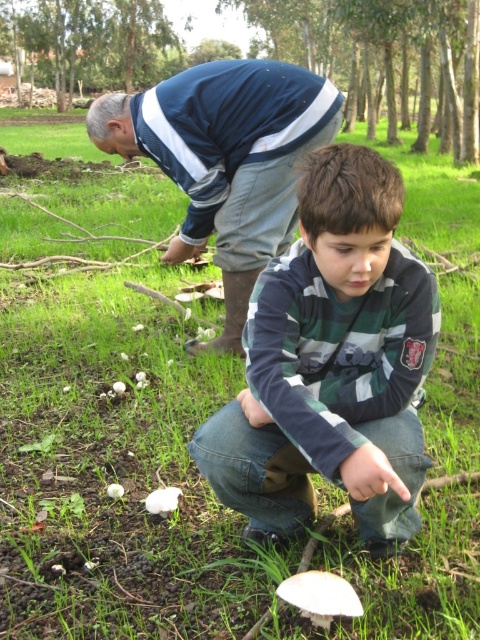
Who is higher up, green striped sweater at center or blue striped sweater at upper center?

blue striped sweater at upper center

Does green striped sweater at center have a lesser width compared to blue striped sweater at upper center?

Correct, green striped sweater at center's width is less than blue striped sweater at upper center's.

The width and height of the screenshot is (480, 640). In order to click on green striped sweater at center in this screenshot , I will do `click(332, 364)`.